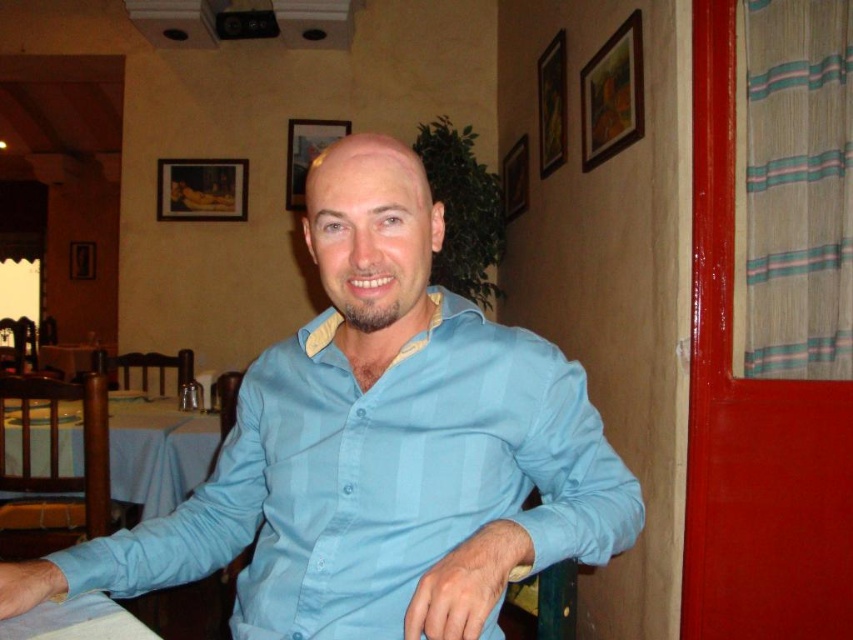
You are a photographer adjusting your camera settings and notice the light blue striped shirt at center and the blue fabric table at lower left in the frame. Which object is closer to the camera?

The light blue striped shirt at center is closer to the camera because it is in front of the blue fabric table at lower left.

Based on the scene, which object between the light blue striped shirt at center and the white fabric table at lower left is bigger in size?

The light blue striped shirt at center is larger in size compared to the white fabric table at lower left according to the description.

Consider the image. What is located at the coordinates point (157, 451)?

At point (157, 451) lies blue fabric table at lower left.